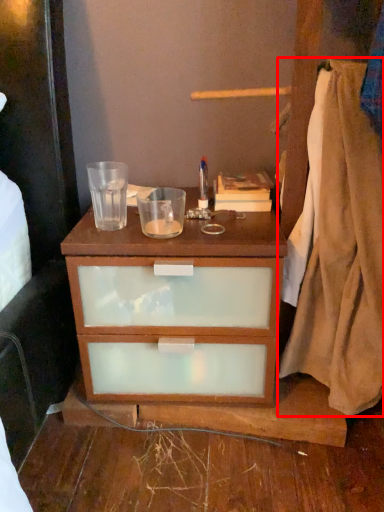
Question: From the image's perspective, where is blanket (annotated by the red box) located in relation to book in the image?

Choices:
 (A) below
 (B) above

Answer: (A)